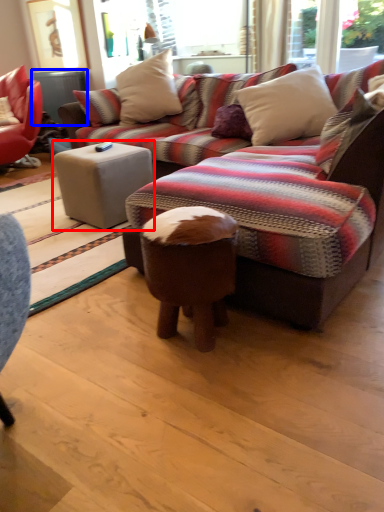
Question: Which point is further to the camera, table (highlighted by a red box) or table (highlighted by a blue box)?

Choices:
 (A) table
 (B) table

Answer: (B)